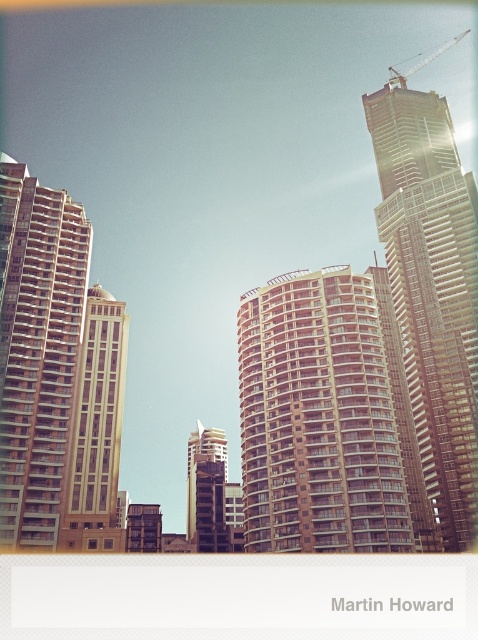
Question: Which of the following is the closest to the observer?

Choices:
 (A) metallic glass tower at center
 (B) matte glass tower at left
 (C) metallic gray crane at upper right
 (D) beige textured building at center

Answer: (D)

Question: Which object is closer to the camera taking this photo?

Choices:
 (A) glassy steel skyscraper at upper right
 (B) matte glass tower at left

Answer: (B)

Question: Which of the following is the closest to the observer?

Choices:
 (A) brown glass building at left
 (B) metallic gray crane at upper right
 (C) beige textured building at center

Answer: (A)

Question: Can you confirm if brown glass building at left is positioned to the left of metallic glass tower at center?

Choices:
 (A) yes
 (B) no

Answer: (A)

Question: Observing the image, what is the correct spatial positioning of beige textured building at center in reference to brown glass building at left?

Choices:
 (A) left
 (B) right

Answer: (B)

Question: Can you confirm if brown glass building at left is thinner than matte glass tower at left?

Choices:
 (A) yes
 (B) no

Answer: (B)